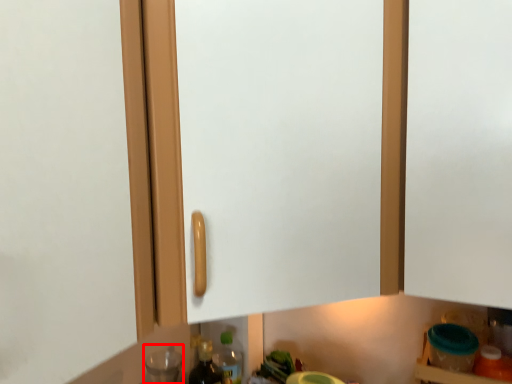
Question: From the image's perspective, where is bottle (annotated by the red box) located in relation to bottle in the image?

Choices:
 (A) above
 (B) below

Answer: (B)